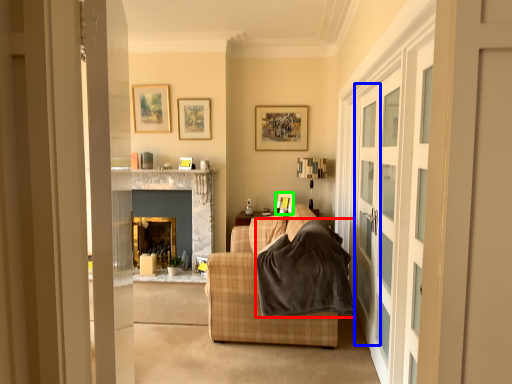
Question: Based on their relative distances, which object is nearer to blanket (highlighted by a red box)? Choose from screen door (highlighted by a blue box) and picture frame (highlighted by a green box).

Choices:
 (A) screen door
 (B) picture frame

Answer: (A)